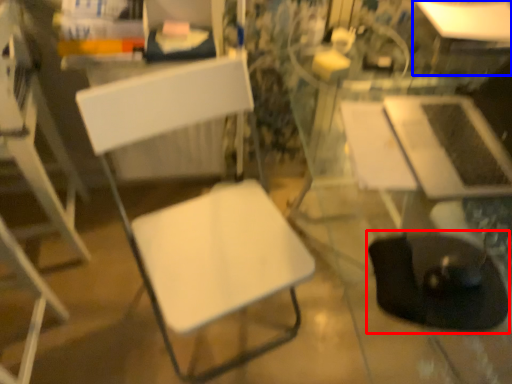
Question: Which of the following is the closest to the observer, swivel chair (highlighted by a red box) or table (highlighted by a blue box)?

Choices:
 (A) swivel chair
 (B) table

Answer: (A)